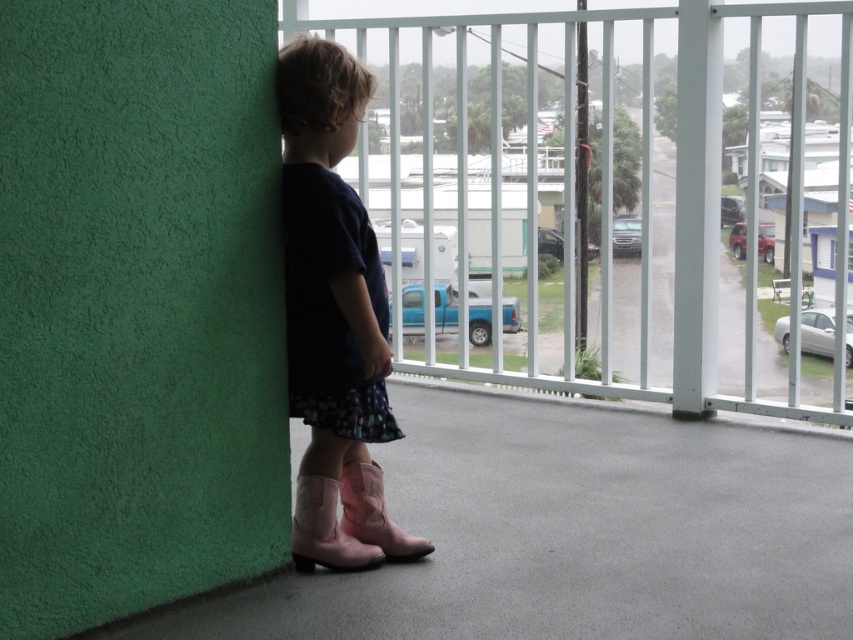
Does white metal railing at upper center have a lesser width compared to pink suede boots at lower left?

No, white metal railing at upper center is not thinner than pink suede boots at lower left.

Is white metal railing at upper center above pink suede boots at lower left?

Yes.

Which is behind, point (613, 17) or point (316, 129)?

Point (613, 17)

At what (x,y) coordinates should I click in order to perform the action: click on white metal railing at upper center. Please return your answer as a coordinate pair (x, y). Looking at the image, I should click on (643, 189).

Does pink suede boots at lower left appear under pink suede boot at lower left?

No, pink suede boots at lower left is not below pink suede boot at lower left.

Can you confirm if pink suede boots at lower left is positioned to the right of pink suede boot at lower left?

Incorrect, pink suede boots at lower left is not on the right side of pink suede boot at lower left.

Which is in front, point (276, 68) or point (364, 524)?

Point (276, 68)

The width and height of the screenshot is (853, 640). I want to click on pink suede boots at lower left, so click(x=334, y=316).

Between white metal railing at upper center and pink suede boot at lower left, which one appears on the left side from the viewer's perspective?

pink suede boot at lower left

Measure the distance between white metal railing at upper center and pink suede boot at lower left.

The distance of white metal railing at upper center from pink suede boot at lower left is 13.75 feet.

Is point (606, 120) in front of point (409, 556)?

No.

You are a GUI agent. You are given a task and a screenshot of the screen. Output one action in this format:
    pyautogui.click(x=<x>, y=<y>)
    Task: Click on the white metal railing at upper center
    
    Given the screenshot: What is the action you would take?
    [x=643, y=189]